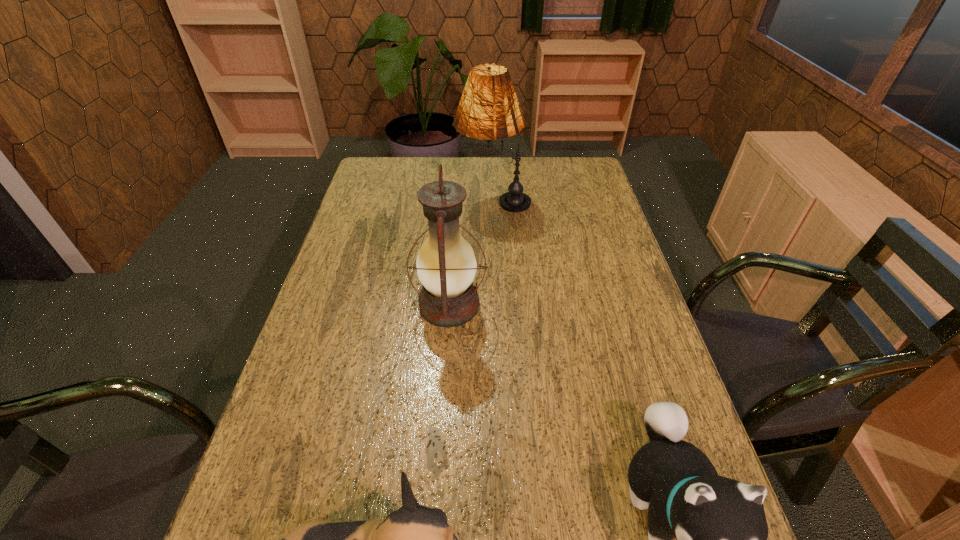
Where is `vacant area at the far left corner`? Image resolution: width=960 pixels, height=540 pixels. vacant area at the far left corner is located at coordinates (402, 181).

In order to click on free location at the far right corner in this screenshot , I will do `click(554, 176)`.

Select which object is the second closest to the second farthest object. Please provide its 2D coordinates. Your answer should be formatted as a tuple, i.e. [(x, y)], where the tuple contains the x and y coordinates of a point satisfying the conditions above.

[(720, 526)]

Where is `the closest object relative to the left puppy`? The height and width of the screenshot is (540, 960). the closest object relative to the left puppy is located at coordinates (720, 526).

At what (x,y) coordinates should I click in order to perform the action: click on blank area in the image that satisfies the following two spatial constraints: 1. on the front-facing side of the lampshade; 2. on the front side of the second farthest object. Please return your answer as a coordinate pair (x, y). This screenshot has height=540, width=960. Looking at the image, I should click on (497, 305).